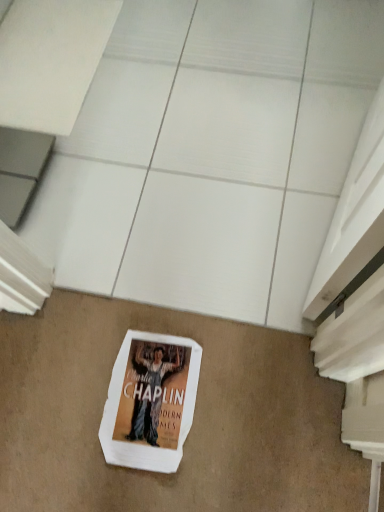
In order to click on empty space that is ontop of white paper flyer at center in this screenshot , I will do [x=140, y=397].